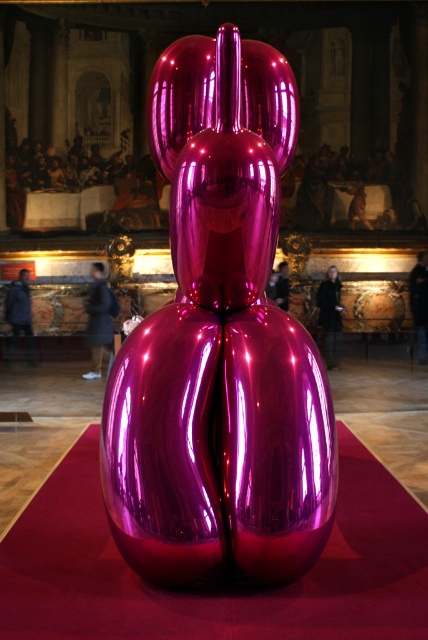
Can you confirm if dark blue fabric jacket at center is positioned to the right of dark blue jeans at lower right?

No, dark blue fabric jacket at center is not to the right of dark blue jeans at lower right.

Is point (107, 337) more distant than point (425, 298)?

No, (107, 337) is closer to viewer.

Locate an element on the screen. This screenshot has height=640, width=428. dark blue fabric jacket at center is located at coordinates pyautogui.click(x=98, y=320).

In the scene shown: Is denim jacket at left taller than dark blue jeans at lower right?

No, denim jacket at left is not taller than dark blue jeans at lower right.

Image resolution: width=428 pixels, height=640 pixels. What do you see at coordinates (20, 316) in the screenshot?
I see `denim jacket at left` at bounding box center [20, 316].

Who is more forward, (12, 324) or (424, 324)?

Positioned in front is point (12, 324).

Where is `denim jacket at left`? denim jacket at left is located at coordinates (20, 316).

Between glossy purple mat at center and denim jacket at left, which one has less height?

glossy purple mat at center is shorter.

Is glossy purple mat at center positioned before denim jacket at left?

That is True.

Where is `glossy purple mat at center`? The width and height of the screenshot is (428, 640). glossy purple mat at center is located at coordinates (217, 586).